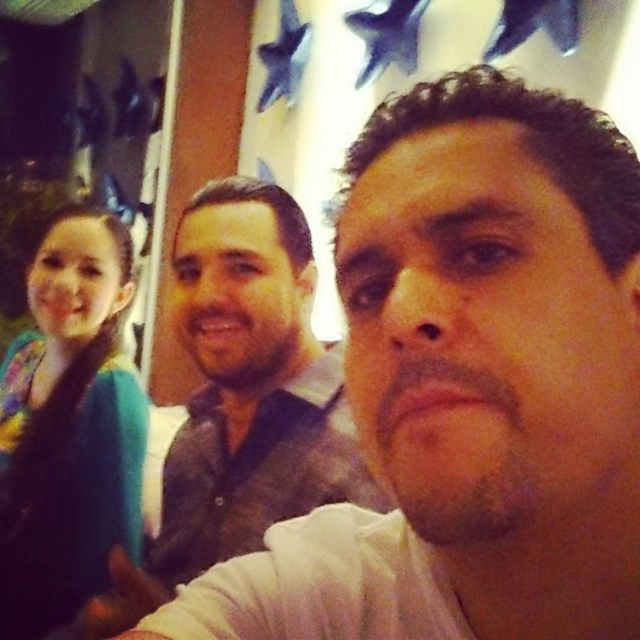
Question: Does white matte shirt at center come behind teal fabric shirt at left?

Choices:
 (A) yes
 (B) no

Answer: (B)

Question: Which point is closer to the camera?

Choices:
 (A) white matte shirt at center
 (B) teal fabric shirt at left

Answer: (A)

Question: Which point appears closest to the camera in this image?

Choices:
 (A) click(314, 440)
 (B) click(83, 307)

Answer: (A)

Question: From the image, what is the correct spatial relationship of white matte shirt at center in relation to teal fabric shirt at left?

Choices:
 (A) left
 (B) right

Answer: (B)

Question: Which object appears closest to the camera in this image?

Choices:
 (A) white matte shirt at center
 (B) teal fabric shirt at left

Answer: (A)

Question: Is white matte shirt at center bigger than teal fabric shirt at left?

Choices:
 (A) yes
 (B) no

Answer: (B)